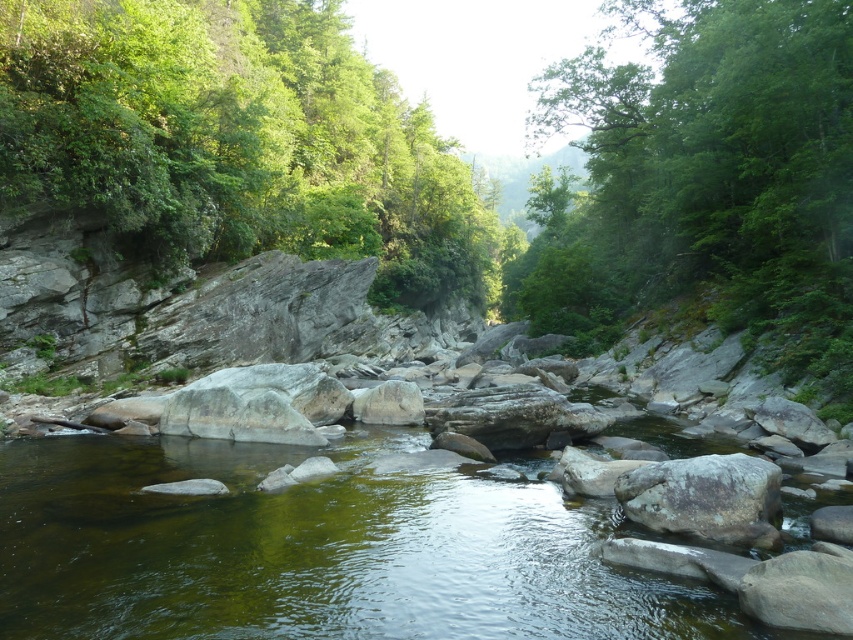
Who is higher up, green leafy tree at upper left or green leafy tree at upper center?

green leafy tree at upper center

Between green leafy tree at upper left and green leafy tree at upper center, which one appears on the left side from the viewer's perspective?

From the viewer's perspective, green leafy tree at upper left appears more on the left side.

Does point (204, 108) lie in front of point (664, 204)?

Yes, point (204, 108) is closer to viewer.

At what (x,y) coordinates should I click in order to perform the action: click on green leafy tree at upper left. Please return your answer as a coordinate pair (x, y). This screenshot has height=640, width=853. Looking at the image, I should click on (239, 141).

Who is shorter, green leafy tree at upper center or gray rough rock at center?

Standing shorter between the two is gray rough rock at center.

This screenshot has width=853, height=640. What do you see at coordinates (706, 182) in the screenshot?
I see `green leafy tree at upper center` at bounding box center [706, 182].

What do you see at coordinates (706, 182) in the screenshot? I see `green leafy tree at upper center` at bounding box center [706, 182].

You are a GUI agent. You are given a task and a screenshot of the screen. Output one action in this format:
    pyautogui.click(x=<x>, y=<y>)
    Task: Click on the green leafy tree at upper center
    The width and height of the screenshot is (853, 640).
    Given the screenshot: What is the action you would take?
    pyautogui.click(x=706, y=182)

Does green leafy tree at upper left have a lesser width compared to gray rough rock at center?

Incorrect, green leafy tree at upper left's width is not less than gray rough rock at center's.

Is green leafy tree at upper left smaller than gray rough rock at center?

Actually, green leafy tree at upper left might be larger than gray rough rock at center.

At what (x,y) coordinates should I click in order to perform the action: click on green leafy tree at upper left. Please return your answer as a coordinate pair (x, y). Image resolution: width=853 pixels, height=640 pixels. Looking at the image, I should click on (239, 141).